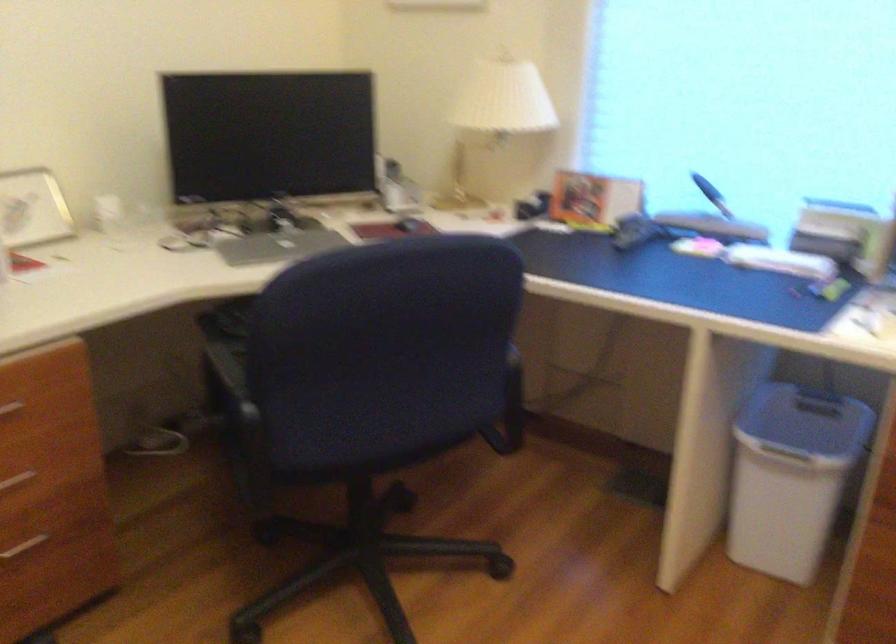
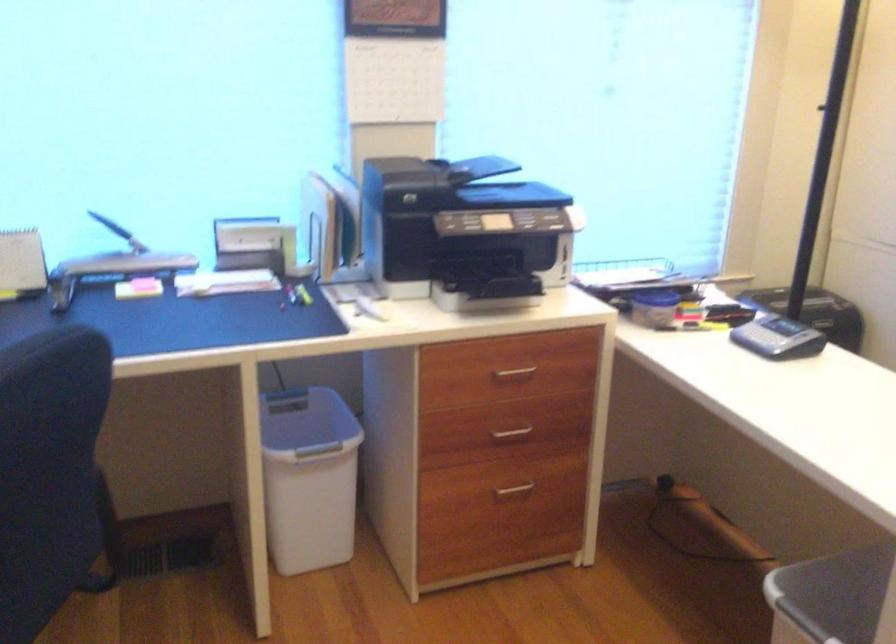
The point at (x=701, y=218) is marked in the first image. Where is the corresponding point in the second image?

(124, 257)